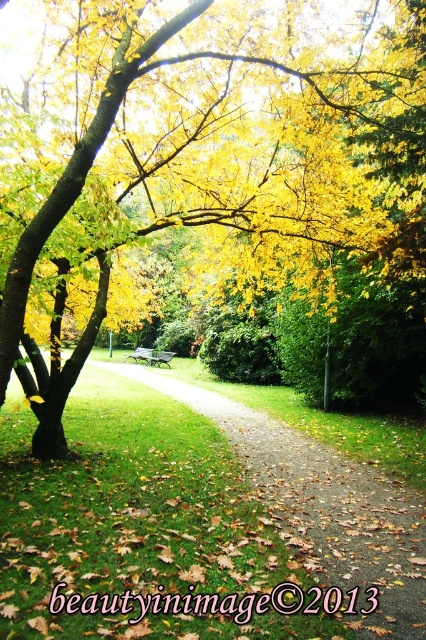
Question: Which object appears closest to the camera in this image?

Choices:
 (A) yellow leafy tree at upper left
 (B) green wooden bench at center
 (C) wooden park bench at center
 (D) brown gravel path at center

Answer: (D)

Question: Can you confirm if brown gravel path at center is positioned below wooden park bench at center?

Choices:
 (A) no
 (B) yes

Answer: (B)

Question: Does brown gravel path at center have a larger size compared to wooden park bench at center?

Choices:
 (A) no
 (B) yes

Answer: (B)

Question: Estimate the real-world distances between objects in this image. Which object is farther from the green wooden bench at center?

Choices:
 (A) brown gravel path at center
 (B) yellow leafy tree at upper left

Answer: (B)

Question: Which point appears farthest from the camera in this image?

Choices:
 (A) (342, 536)
 (B) (164, 355)
 (C) (322, 96)
 (D) (154, 355)

Answer: (D)

Question: From the image, what is the correct spatial relationship of green wooden bench at center in relation to wooden park bench at center?

Choices:
 (A) left
 (B) right

Answer: (A)